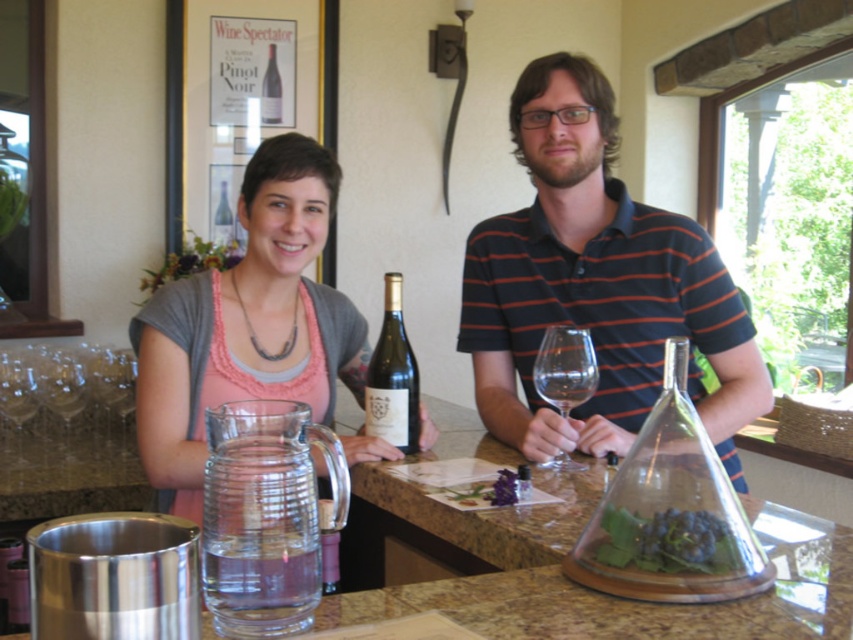
Question: Which point is closer to the camera?

Choices:
 (A) (541, 362)
 (B) (512, 349)

Answer: (A)

Question: Does matte glass pitcher at center have a smaller size compared to matte glass wine bottle at upper center?

Choices:
 (A) no
 (B) yes

Answer: (A)

Question: Among these objects, which one is nearest to the camera?

Choices:
 (A) matte glass wine bottle at upper center
 (B) matte glass pitcher at center
 (C) clear glass wine glass at left

Answer: (B)

Question: Which object appears farthest from the camera in this image?

Choices:
 (A) matte glass wine at center
 (B) matte glass bottle at center
 (C) transparent glass wine glass at center
 (D) clear glass wine at center

Answer: (B)

Question: Can you confirm if clear glass wine glass at left is positioned above matte glass bottle at center?

Choices:
 (A) no
 (B) yes

Answer: (A)

Question: Is clear glass wine glass at left behind matte glass wine bottle at center?

Choices:
 (A) yes
 (B) no

Answer: (B)